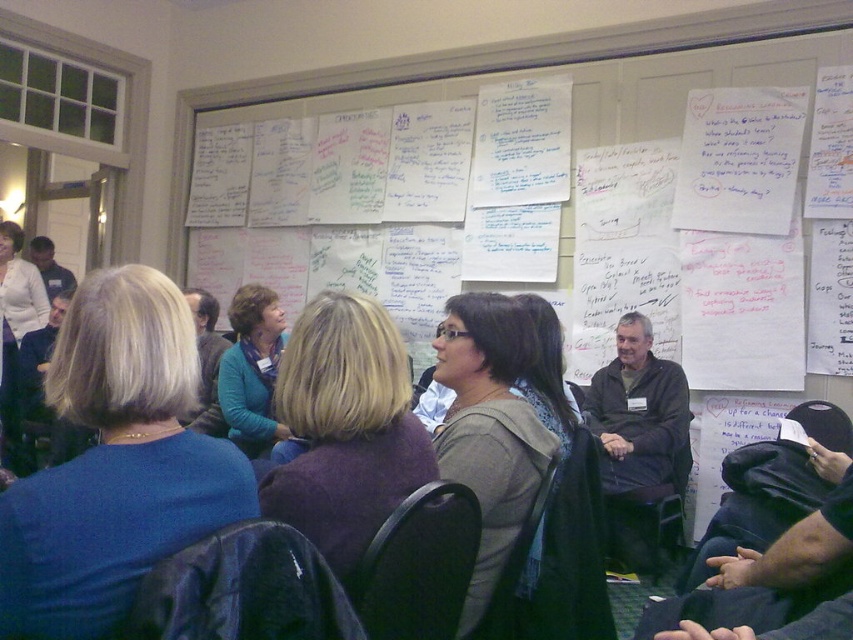
You are organizing a presentation and need to decide which item to move first. Which occupies less space between the blue fabric at center and the blue sweater at center?

The blue fabric at center occupies less space than the blue sweater at center, so you should move the blue fabric at center first.

You are organizing a presentation and need to decide whether to place a laptop on the blue fabric at center or the blue sweater at center. Which surface would you choose based on their sizes?

The blue fabric at center is shorter than the blue sweater at center, so the blue sweater at center would provide a larger surface area for placing the laptop.